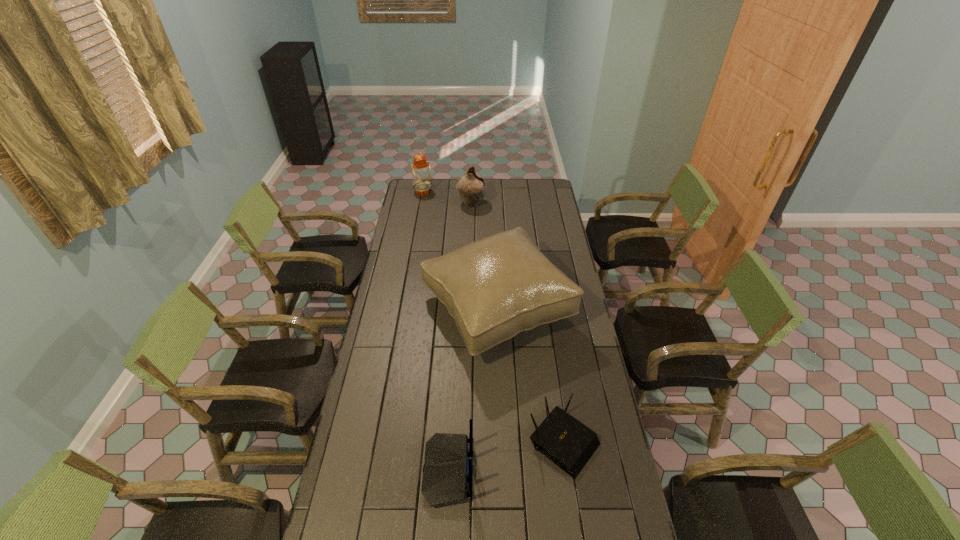
Where is `vacant position located 0.400m on the back of the taller router`? This screenshot has width=960, height=540. vacant position located 0.400m on the back of the taller router is located at coordinates (594, 471).

Where is `free space located 0.390m on the back of the right router`? free space located 0.390m on the back of the right router is located at coordinates (547, 328).

At what (x,y) coordinates should I click in order to perform the action: click on oil lamp at the far edge. Please return your answer as a coordinate pair (x, y). This screenshot has width=960, height=540. Looking at the image, I should click on click(x=421, y=171).

Where is `pottery located in the far edge section of the desktop`? This screenshot has width=960, height=540. pottery located in the far edge section of the desktop is located at coordinates (471, 188).

Locate an element on the screen. This screenshot has height=540, width=960. object positioned at the left edge is located at coordinates (421, 171).

Where is `cushion positioned at the right edge`? The height and width of the screenshot is (540, 960). cushion positioned at the right edge is located at coordinates (496, 287).

The image size is (960, 540). Identify the location of router that is positioned at the right edge. (568, 443).

Identify the location of object that is at the far left corner. (421, 171).

Where is `blank area at the far edge`? The width and height of the screenshot is (960, 540). blank area at the far edge is located at coordinates (x=445, y=188).

I want to click on free region at the left edge of the desktop, so click(x=399, y=244).